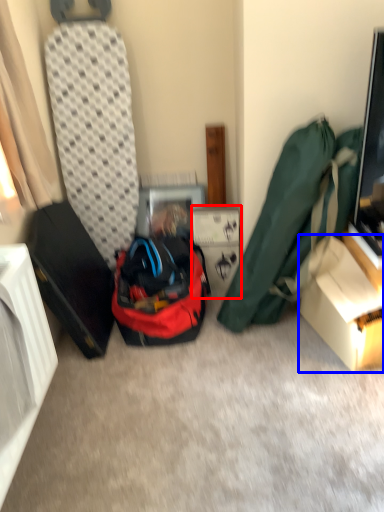
Question: Among these objects, which one is farthest to the camera, cardboard box (highlighted by a red box) or box (highlighted by a blue box)?

Choices:
 (A) cardboard box
 (B) box

Answer: (A)